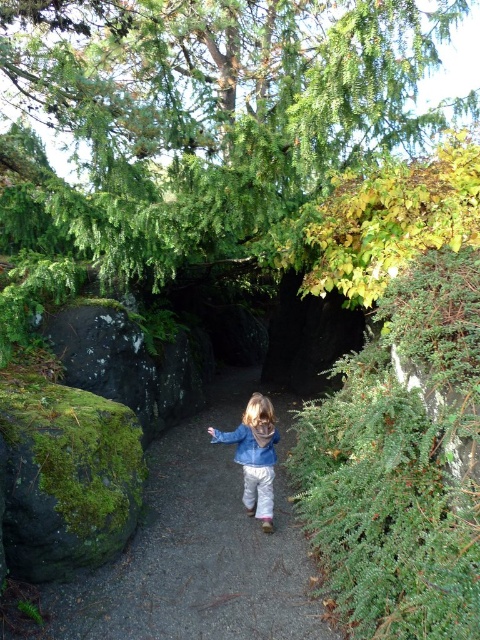
Question: Does denim jacket at center appear on the left side of blue denim jacket at center?

Choices:
 (A) yes
 (B) no

Answer: (B)

Question: Does denim jacket at center appear on the left side of blue denim jacket at center?

Choices:
 (A) no
 (B) yes

Answer: (A)

Question: Is denim jacket at center closer to camera compared to blue denim jacket at center?

Choices:
 (A) yes
 (B) no

Answer: (A)

Question: Which point is farther from the camera taking this photo?

Choices:
 (A) (277, 435)
 (B) (222, 67)

Answer: (B)

Question: Which point is closer to the camera taking this photo?

Choices:
 (A) (97, 28)
 (B) (275, 580)
 (C) (271, 467)
 (D) (264, 445)

Answer: (B)

Question: Which point is farther to the camera?

Choices:
 (A) denim jacket at center
 (B) green leafy tree at upper center

Answer: (A)